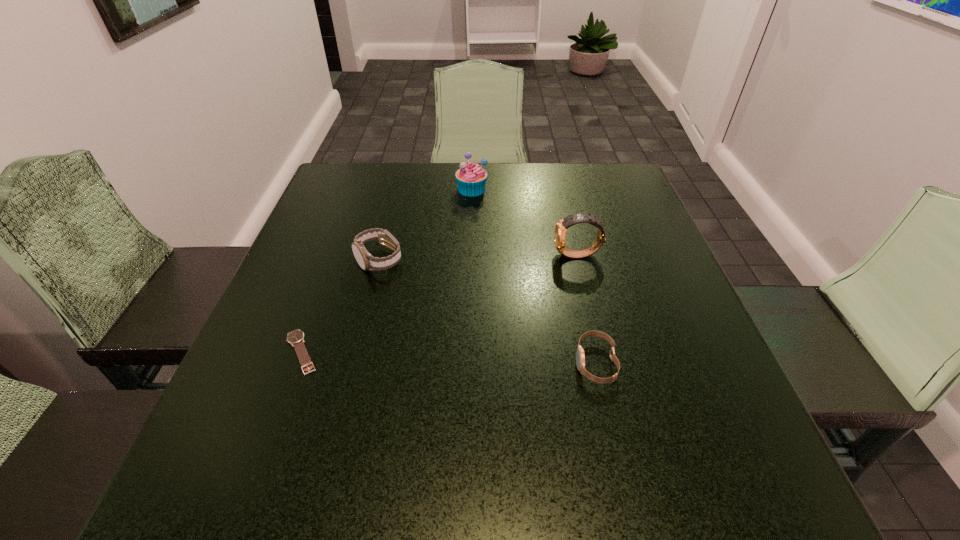
In the image, there is a desktop. At what (x,y) coordinates should I click in order to perform the action: click on vacant space at the near edge. Please return your answer as a coordinate pair (x, y). The image size is (960, 540). Looking at the image, I should click on (442, 509).

In the image, there is a desktop. Where is `free space at the left edge`? The image size is (960, 540). free space at the left edge is located at coordinates (310, 340).

You are a GUI agent. You are given a task and a screenshot of the screen. Output one action in this format:
    pyautogui.click(x=<x>, y=<y>)
    Task: Click on the vacant space at the right edge of the desktop
    
    Given the screenshot: What is the action you would take?
    pyautogui.click(x=657, y=302)

Where is `free space between the third watch from right to left and the second shortest object`? This screenshot has width=960, height=540. free space between the third watch from right to left and the second shortest object is located at coordinates (488, 312).

Image resolution: width=960 pixels, height=540 pixels. Find the location of `empty space that is in between the tallest watch and the third tallest watch`. empty space that is in between the tallest watch and the third tallest watch is located at coordinates (587, 309).

Where is `vacant area between the fourth tallest object and the tallest watch`? The image size is (960, 540). vacant area between the fourth tallest object and the tallest watch is located at coordinates (587, 309).

Where is `empty space that is in between the third watch from right to left and the second shortest watch`? Image resolution: width=960 pixels, height=540 pixels. empty space that is in between the third watch from right to left and the second shortest watch is located at coordinates (488, 312).

Identify the location of free space between the second shortest object and the leftmost object. This screenshot has width=960, height=540. tap(448, 357).

I want to click on empty space that is in between the third object from right to left and the second shortest watch, so click(534, 276).

Where is `empty space that is in between the shortest object and the muffin`? empty space that is in between the shortest object and the muffin is located at coordinates (387, 271).